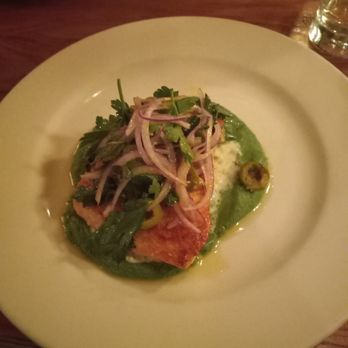
Where is `plate`? The height and width of the screenshot is (348, 348). plate is located at coordinates (286, 130).